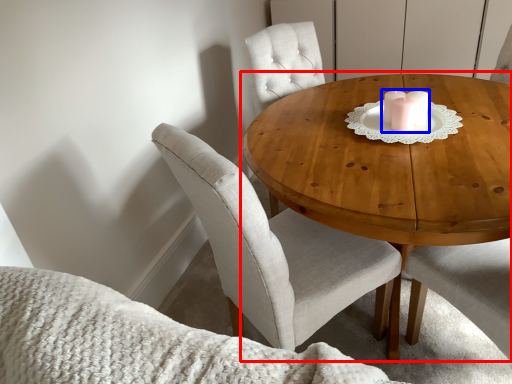
Question: Among these objects, which one is farthest to the camera, coffee table (highlighted by a red box) or candle holder (highlighted by a blue box)?

Choices:
 (A) coffee table
 (B) candle holder

Answer: (B)